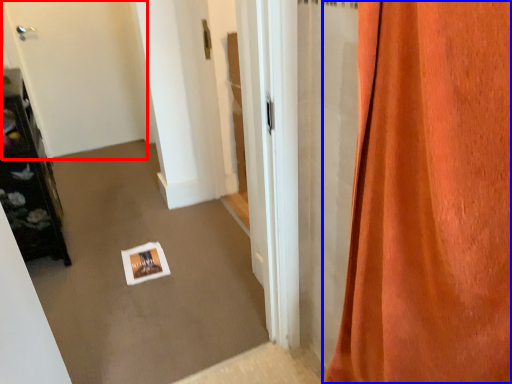
Question: Which point is further to the camera, door (highlighted by a red box) or curtain (highlighted by a blue box)?

Choices:
 (A) door
 (B) curtain

Answer: (A)